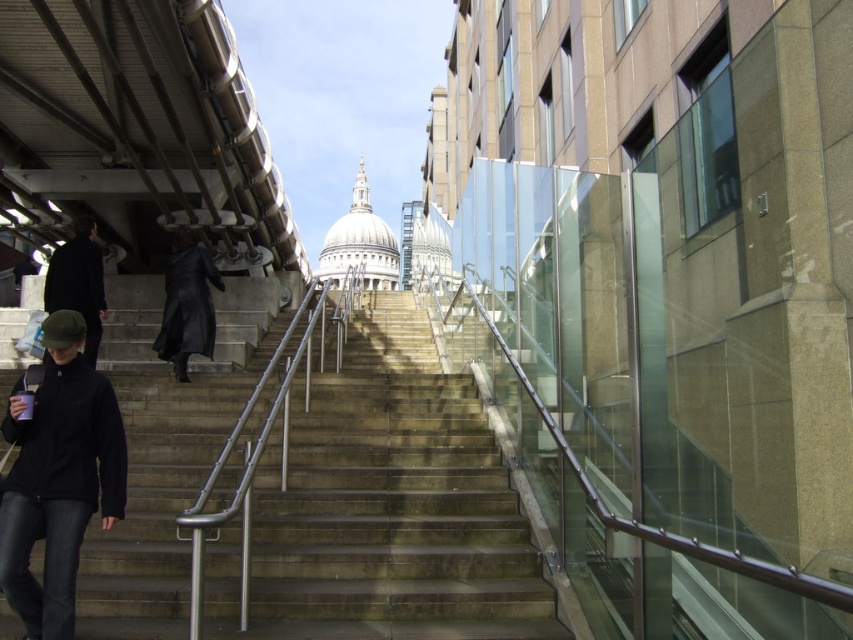
Is black fleece jacket at lower left positioned at the back of black leather coat at center?

No, black fleece jacket at lower left is closer to the viewer.

Can you confirm if black fleece jacket at lower left is smaller than black leather coat at center?

Indeed, black fleece jacket at lower left has a smaller size compared to black leather coat at center.

This screenshot has width=853, height=640. What do you see at coordinates (57, 477) in the screenshot? I see `black fleece jacket at lower left` at bounding box center [57, 477].

Image resolution: width=853 pixels, height=640 pixels. I want to click on black fleece jacket at lower left, so click(x=57, y=477).

Is concrete stairs at center bigger than dark gray woolen jacket at left?

Yes.

Is concrete stairs at center behind dark gray woolen jacket at left?

No, it is in front of dark gray woolen jacket at left.

The width and height of the screenshot is (853, 640). Identify the location of concrete stairs at center. 383,508.

At what (x,y) coordinates should I click in order to perform the action: click on concrete stairs at center. Please return your answer as a coordinate pair (x, y). Looking at the image, I should click on (383, 508).

Does concrete stairs at center lie in front of black fleece jacket at lower left?

That is False.

From the picture: How far apart are concrete stairs at center and black fleece jacket at lower left?

concrete stairs at center and black fleece jacket at lower left are 32.16 feet apart from each other.

At what (x,y) coordinates should I click in order to perform the action: click on concrete stairs at center. Please return your answer as a coordinate pair (x, y). The height and width of the screenshot is (640, 853). Looking at the image, I should click on (383, 508).

You are a GUI agent. You are given a task and a screenshot of the screen. Output one action in this format:
    pyautogui.click(x=<x>, y=<y>)
    Task: Click on the concrete stairs at center
    This screenshot has width=853, height=640.
    Given the screenshot: What is the action you would take?
    pyautogui.click(x=383, y=508)